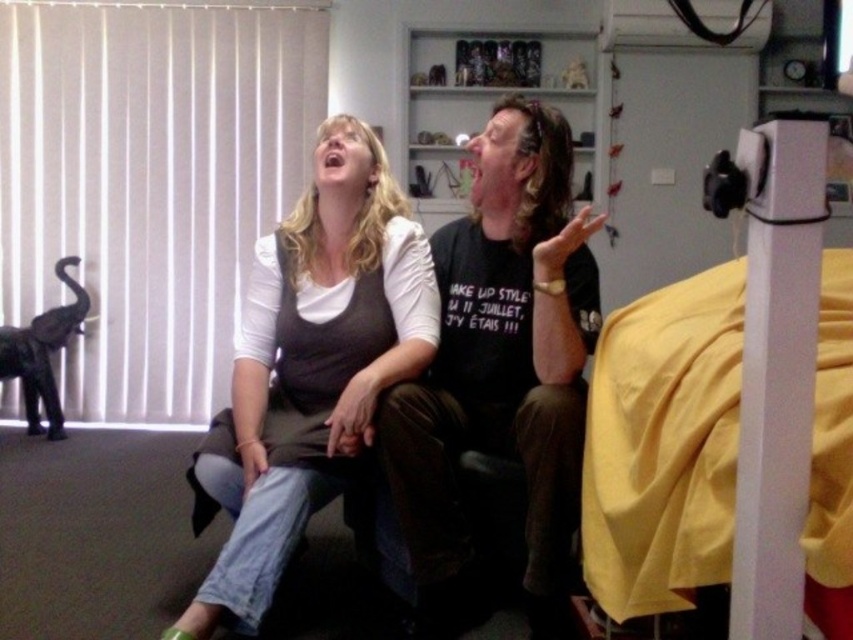
You are a delivery person holding a package that requires a minimum clearance of 1 meter to pass through a doorway. You are facing the yellow fabric bed at right. Is there enough space for you to move through the area between the bed and the wall behind it?

The distance between the yellow fabric bed at right and the viewer is 91.94 centimeters, which is less than the required 1 meter clearance. Therefore, the package cannot safely pass through the space between the yellow fabric bed at right and the wall.

You are a photographer trying to focus on two points in the image. The first point is labeled as point [483,310] and the second is point [311,227]. Which point should you focus on to ensure the closest object is sharp?

Point [483,310] is closer to the camera than point [311,227], so focusing on point [483,310] will ensure the closest object is sharp.